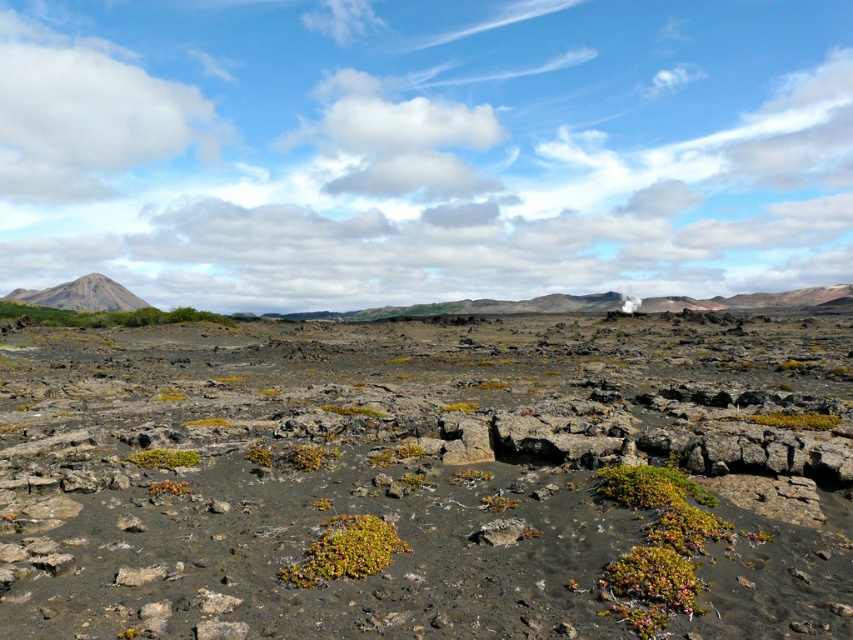
Who is positioned more to the right, dull gray rock at center or green mossy shrub at center?

green mossy shrub at center is more to the right.

Does dull gray rock at center have a greater height compared to green mossy shrub at center?

Yes.

Which is behind, point (573, 598) or point (837, 422)?

The point (837, 422) is more distant.

Image resolution: width=853 pixels, height=640 pixels. Identify the location of dull gray rock at center. (421, 474).

Who is lower down, dull gray rock at center or green mossy patch at center?

green mossy patch at center

Can you confirm if dull gray rock at center is taller than green mossy patch at center?

Yes.

What do you see at coordinates (421, 474) in the screenshot? The width and height of the screenshot is (853, 640). I see `dull gray rock at center` at bounding box center [421, 474].

Find the location of `dull gray rock at center`. dull gray rock at center is located at coordinates (421, 474).

Which is behind, point (364, 432) or point (94, 301)?

Point (94, 301)

Measure the distance between point (825, 540) and camera.

Point (825, 540) and camera are 8.23 meters apart.

Who is more forward, (376, 456) or (61, 298)?

Point (376, 456) is in front.

Where is `dull gray rock at center`? This screenshot has height=640, width=853. dull gray rock at center is located at coordinates (421, 474).